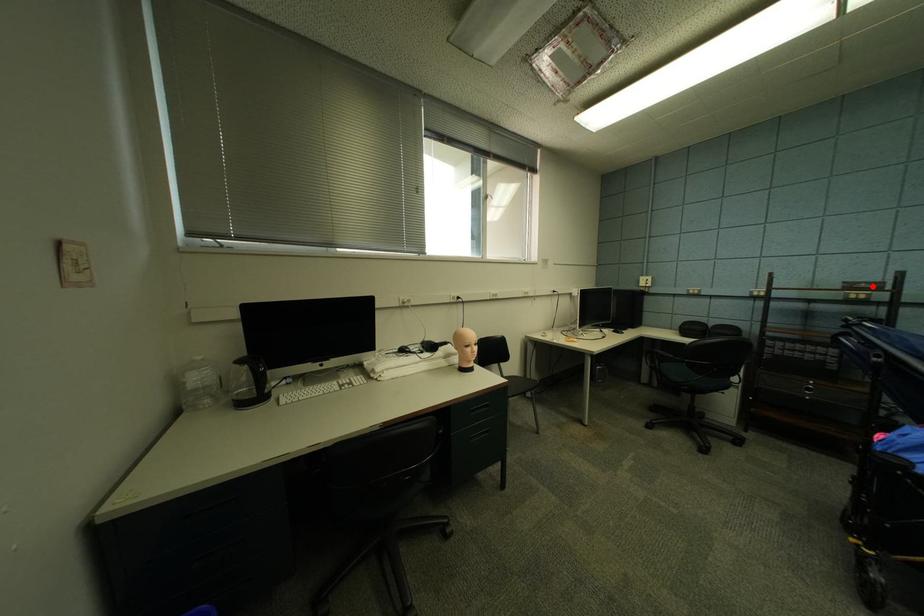
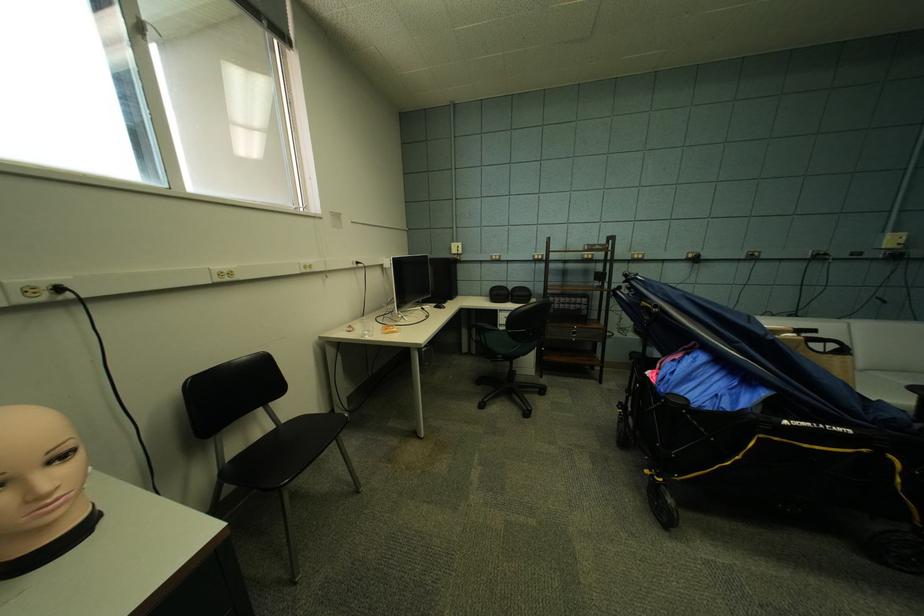
Find the pixel in the second image that matches the highlighted location in the first image.

(606, 248)